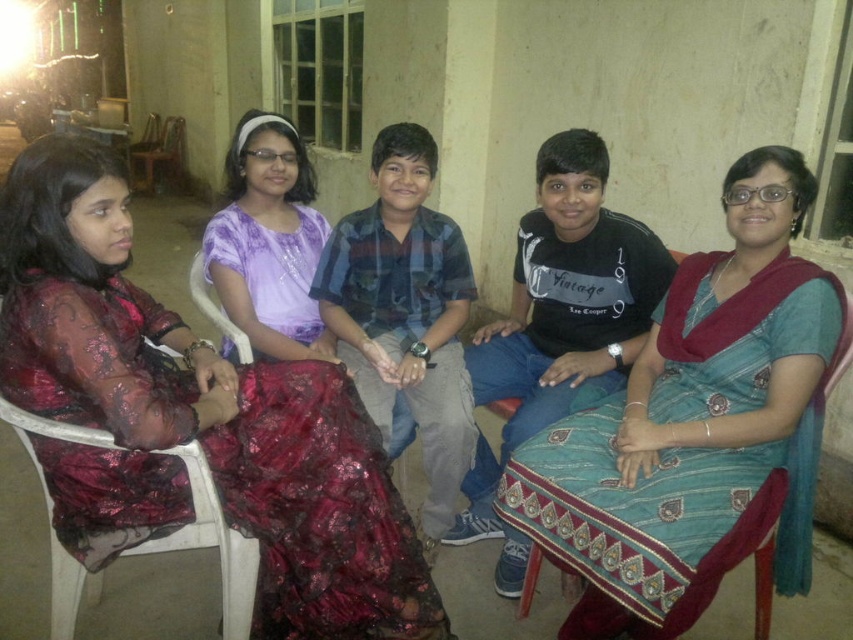
Question: Is teal silk saree at center below wooden chair at left?

Choices:
 (A) no
 (B) yes

Answer: (B)

Question: Which is farther from the teal silk saree at center?

Choices:
 (A) white plastic chair at upper left
 (B) purple sequined dress at center
 (C) shiny red saree at left
 (D) white plastic chair at left

Answer: (A)

Question: Can you confirm if purple sequined dress at center is positioned to the right of wooden chair at left?

Choices:
 (A) yes
 (B) no

Answer: (A)

Question: Which of the following is the closest to the observer?

Choices:
 (A) (779, 152)
 (B) (311, 324)
 (C) (144, 184)

Answer: (A)

Question: Is teal silk saree at center positioned before white plastic chair at upper left?

Choices:
 (A) yes
 (B) no

Answer: (A)

Question: Considering the real-world distances, which object is closest to the white plastic chair at upper left?

Choices:
 (A) purple sequined dress at center
 (B) wooden chair at left
 (C) teal silk saree at center

Answer: (A)